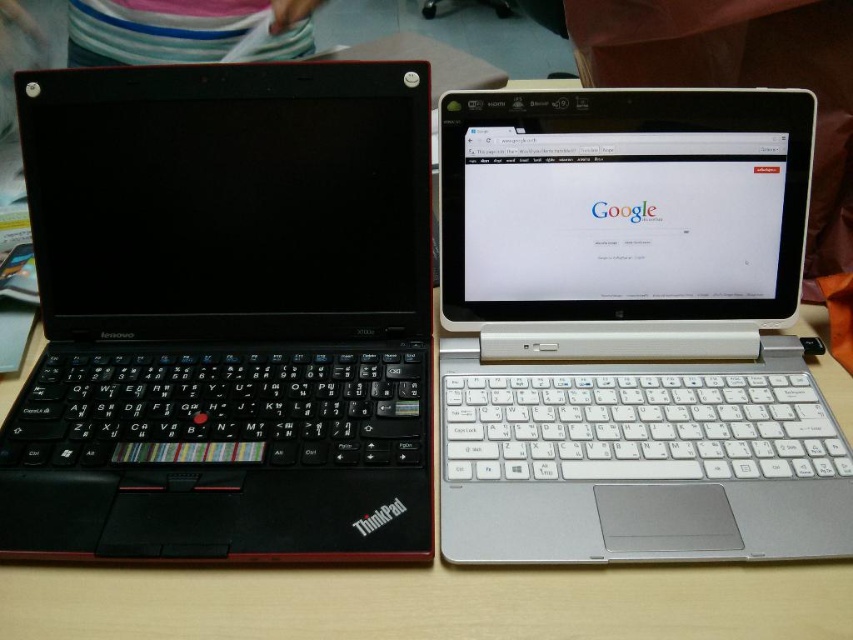
Question: Among these points, which one is farthest from the camera?

Choices:
 (A) (85, 332)
 (B) (595, 204)
 (C) (635, 568)

Answer: (A)

Question: Which object is positioned closest to the white plastic laptop at center?

Choices:
 (A) wooden table at center
 (B) black matte keyboard at left

Answer: (A)

Question: Can you confirm if black matte keyboard at left is positioned below white plastic laptop at center?

Choices:
 (A) yes
 (B) no

Answer: (B)

Question: Which point is closer to the camera?

Choices:
 (A) wooden table at center
 (B) white plastic laptop at center

Answer: (A)

Question: Where is black matte keyboard at left located in relation to wooden table at center in the image?

Choices:
 (A) above
 (B) below

Answer: (A)

Question: Does black matte keyboard at left have a smaller size compared to white plastic laptop at center?

Choices:
 (A) yes
 (B) no

Answer: (A)